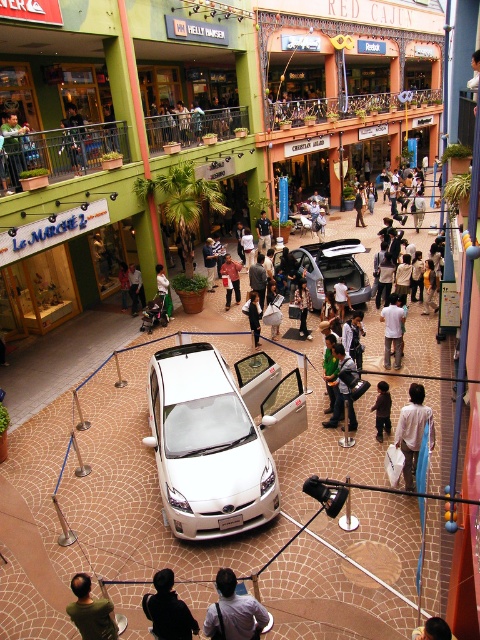
Question: Is light brown leather jacket at center above white fabric bag at center?

Choices:
 (A) yes
 (B) no

Answer: (B)

Question: Which point is farther from the camera taking this photo?

Choices:
 (A) (388, 432)
 (B) (13, 148)

Answer: (B)

Question: Does green fabric bag at center have a larger size compared to orange fabric shirt at center?

Choices:
 (A) yes
 (B) no

Answer: (B)

Question: Is green fabric jacket at center to the right of white cotton shirt at center from the viewer's perspective?

Choices:
 (A) no
 (B) yes

Answer: (A)

Question: Among these objects, which one is farthest from the camera?

Choices:
 (A) white glossy car at center
 (B) green fabric bag at center
 (C) green fabric jacket at center
 (D) denim jacket at center

Answer: (C)

Question: Which object is positioned farthest from the white cotton shirt at center?

Choices:
 (A) light brown leather jacket at center
 (B) green fabric backpack at center
 (C) dark blue jeans at center

Answer: (B)